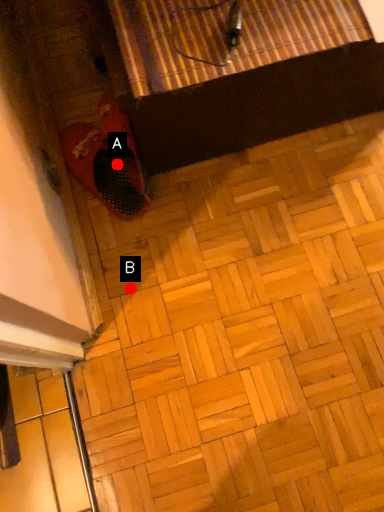
Question: Two points are circled on the image, labeled by A and B beside each circle. Which point is closer to the camera taking this photo?

Choices:
 (A) A is closer
 (B) B is closer

Answer: (B)